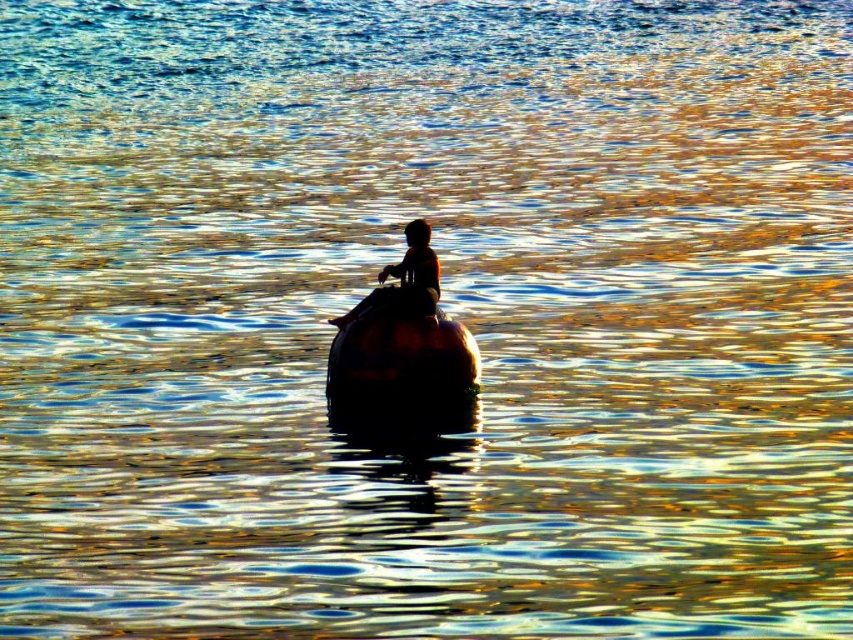
Question: Which of the following is the farthest from the observer?

Choices:
 (A) (352, 378)
 (B) (407, 285)

Answer: (B)

Question: Which of the following is the farthest from the observer?

Choices:
 (A) (410, 244)
 (B) (346, 401)

Answer: (B)

Question: Does shiny brown boat at center appear on the right side of silhouette human at center?

Choices:
 (A) yes
 (B) no

Answer: (B)

Question: Which of the following is the farthest from the observer?

Choices:
 (A) silhouette human at center
 (B) shiny brown boat at center

Answer: (A)

Question: Is shiny brown boat at center to the right of silhouette human at center from the viewer's perspective?

Choices:
 (A) no
 (B) yes

Answer: (A)

Question: Is shiny brown boat at center behind silhouette human at center?

Choices:
 (A) yes
 (B) no

Answer: (B)